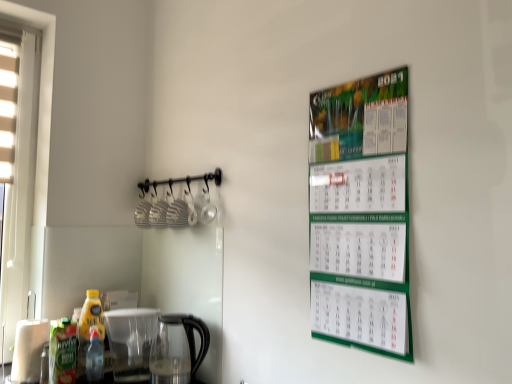
Question: Would you say translucent plastic bottle at lower left, the third bottle from the left, is to the left or to the right of transparent glass coffeepot at lower center in the picture?

Choices:
 (A) right
 (B) left

Answer: (B)

Question: Is point (89, 354) closer or farther from the camera than point (151, 382)?

Choices:
 (A) farther
 (B) closer

Answer: (A)

Question: Which object is the closest to the green matte calendar at upper right?

Choices:
 (A) translucent plastic bottle at lower left, arranged as the 1th bottle when viewed from the right
 (B) transparent glass coffeepot at lower center
 (C) yellow plastic bottle at lower left, acting as the second bottle starting from the right
 (D) green matte juice at lower left, the first bottle in the left-to-right sequence

Answer: (B)

Question: Considering the real-world distances, which object is farthest from the green matte calendar at upper right?

Choices:
 (A) transparent glass coffeepot at lower center
 (B) translucent plastic bottle at lower left, arranged as the 1th bottle when viewed from the right
 (C) green matte juice at lower left, the first bottle in the left-to-right sequence
 (D) yellow plastic bottle at lower left, acting as the second bottle starting from the right

Answer: (C)